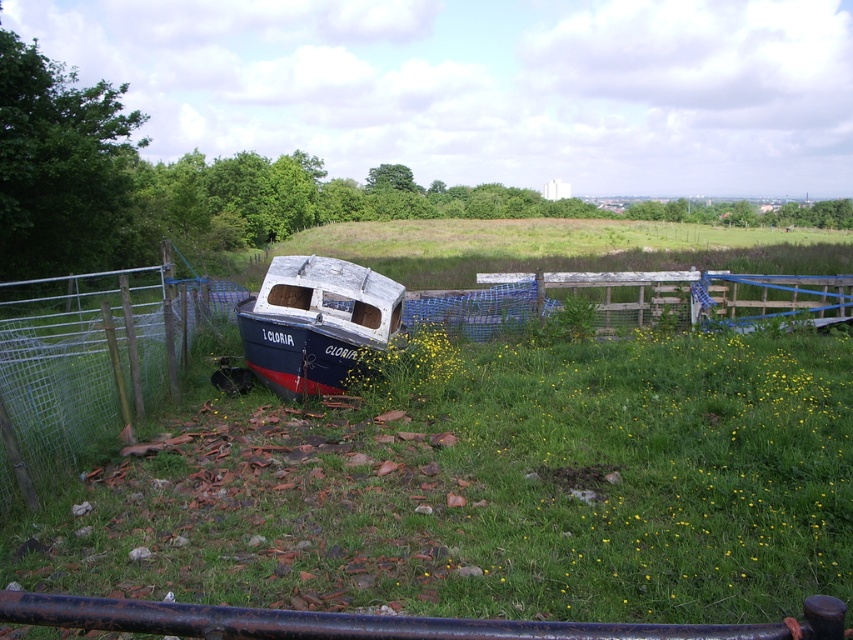
Is the position of wire mesh fence at lower left less distant than that of rusty metal rail at lower center?

No, it is not.

Can you confirm if wire mesh fence at lower left is shorter than rusty metal rail at lower center?

In fact, wire mesh fence at lower left may be taller than rusty metal rail at lower center.

At what (x,y) coordinates should I click in order to perform the action: click on wire mesh fence at lower left. Please return your answer as a coordinate pair (x, y). The height and width of the screenshot is (640, 853). Looking at the image, I should click on (90, 360).

Which is more to the left, wire mesh fence at lower left or blue painted wooden boat at center?

wire mesh fence at lower left

Who is more distant from viewer, (80,326) or (299,260)?

The point (80,326) is behind.

Is point (22, 333) more distant than point (248, 300)?

Yes.

Find the location of a particular element. wire mesh fence at lower left is located at coordinates (90, 360).

Does green grassy at center appear on the right side of rusty metal rail at lower center?

Indeed, green grassy at center is positioned on the right side of rusty metal rail at lower center.

Who is positioned more to the left, green grassy at center or rusty metal rail at lower center?

From the viewer's perspective, rusty metal rail at lower center appears more on the left side.

Does point (461, 529) come behind point (413, 632)?

Yes, point (461, 529) is behind point (413, 632).

Locate an element on the screen. This screenshot has height=640, width=853. green grassy at center is located at coordinates (492, 493).